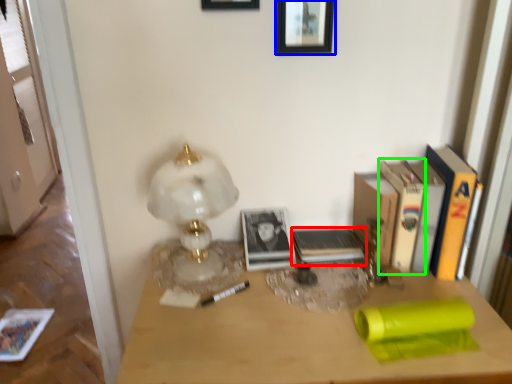
Question: Estimate the real-world distances between objects in this image. Which object is closer to paperback book (highlighted by a red box), picture frame (highlighted by a blue box) or paperback book (highlighted by a green box)?

Choices:
 (A) picture frame
 (B) paperback book

Answer: (B)